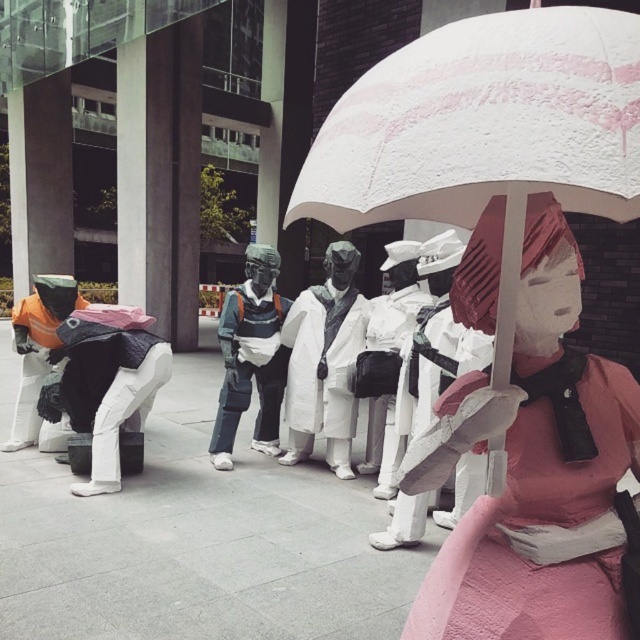
Question: Is white matte umbrella at center in front of metallic silver helmet at center?

Choices:
 (A) yes
 (B) no

Answer: (A)

Question: Which point is farther from the camera taking this photo?

Choices:
 (A) (364, 81)
 (B) (307, 365)
 (C) (262, 416)
 (D) (477, 438)

Answer: (C)

Question: Does white matte umbrella at center have a greater width compared to white matte coat at center?

Choices:
 (A) yes
 (B) no

Answer: (A)

Question: Which point is farther to the camera?

Choices:
 (A) (461, 182)
 (B) (545, 387)
 (C) (221, 456)
 (D) (332, 449)

Answer: (D)

Question: Can you confirm if white matte umbrella at center is positioned above white matte coat at center?

Choices:
 (A) no
 (B) yes

Answer: (B)

Question: Which object is the closest to the white matte umbrella at center?

Choices:
 (A) metallic silver helmet at center
 (B) white matte coat at center
 (C) pink matte umbrella at upper center

Answer: (C)